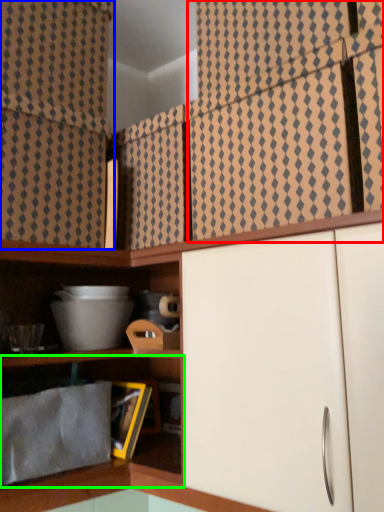
Question: Which object is the farthest from curtain (highlighted by a red box)? Choose among these: curtain (highlighted by a blue box) or shelf (highlighted by a green box).

Choices:
 (A) curtain
 (B) shelf

Answer: (B)